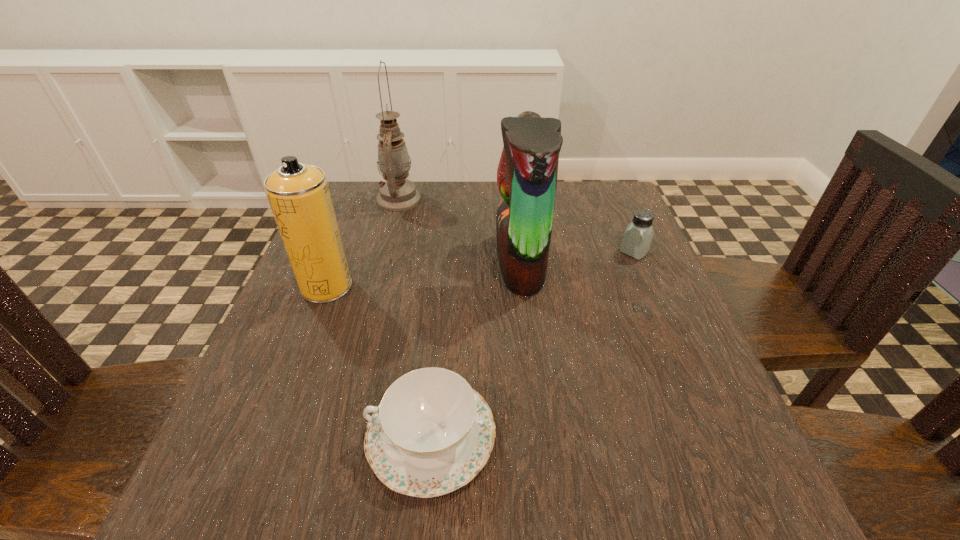
Choose which object is the fourth nearest neighbor to the saltshaker. Please provide its 2D coordinates. Your answer should be formatted as a tuple, i.e. [(x, y)], where the tuple contains the x and y coordinates of a point satisfying the conditions above.

[(299, 196)]

The image size is (960, 540). Identify the location of the second closest object relative to the rightmost object. (432, 433).

What are the coordinates of `free location that satisfies the following two spatial constraints: 1. on the back side of the aerosol can; 2. on the right side of the oil lamp` in the screenshot? It's located at (361, 199).

I want to click on vacant space that satisfies the following two spatial constraints: 1. on the front side of the saltshaker; 2. on the left side of the oil lamp, so click(385, 252).

Where is `vacant region that satisfies the following two spatial constraints: 1. on the front side of the rightmost object; 2. on the handle side of the shortest object`? The image size is (960, 540). vacant region that satisfies the following two spatial constraints: 1. on the front side of the rightmost object; 2. on the handle side of the shortest object is located at coordinates (712, 435).